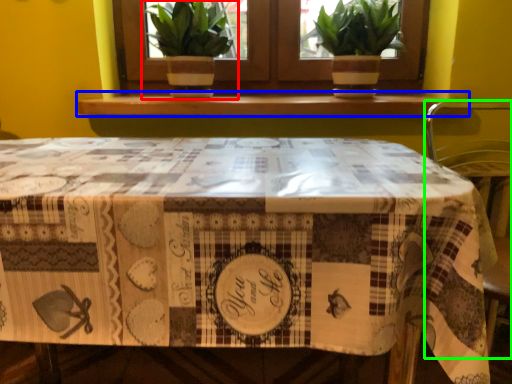
Question: Estimate the real-world distances between objects in this image. Which object is farther from houseplant (highlighted by a red box), window sill (highlighted by a blue box) or chair (highlighted by a green box)?

Choices:
 (A) window sill
 (B) chair

Answer: (B)